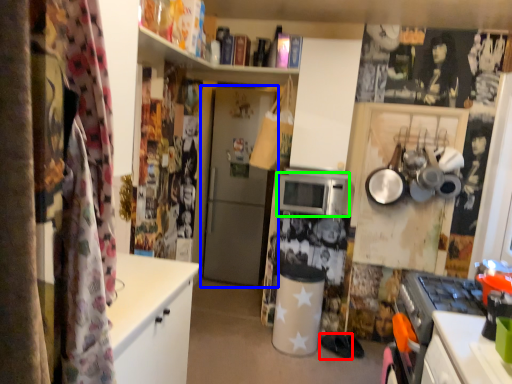
Question: Which object is the farthest from footwear (highlighted by a red box)? Choose among these: door (highlighted by a blue box) or microwave oven (highlighted by a green box).

Choices:
 (A) door
 (B) microwave oven

Answer: (A)